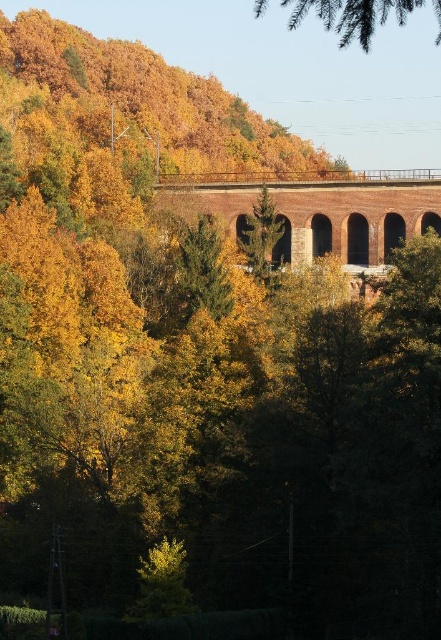
Question: Estimate the real-world distances between objects in this image. Which object is closer to the brick stone train bridge at center?

Choices:
 (A) green needle-like branches at upper center
 (B) green matte tree at center
 (C) green leafy tree at lower center

Answer: (B)

Question: Does brick stone train bridge at center have a greater width compared to green leafy tree at lower center?

Choices:
 (A) no
 (B) yes

Answer: (B)

Question: Does green needle-like branches at upper center appear under green leafy tree at lower center?

Choices:
 (A) no
 (B) yes

Answer: (A)

Question: Which object appears closest to the camera in this image?

Choices:
 (A) green matte tree at center
 (B) green leafy tree at lower center
 (C) green needle-like branches at upper center

Answer: (C)

Question: Is green leafy tree at lower center smaller than green matte tree at center?

Choices:
 (A) yes
 (B) no

Answer: (A)

Question: Which of the following is the closest to the observer?

Choices:
 (A) green matte tree at center
 (B) green needle-like branches at upper center
 (C) brick stone train bridge at center
 (D) green leafy tree at lower center

Answer: (B)